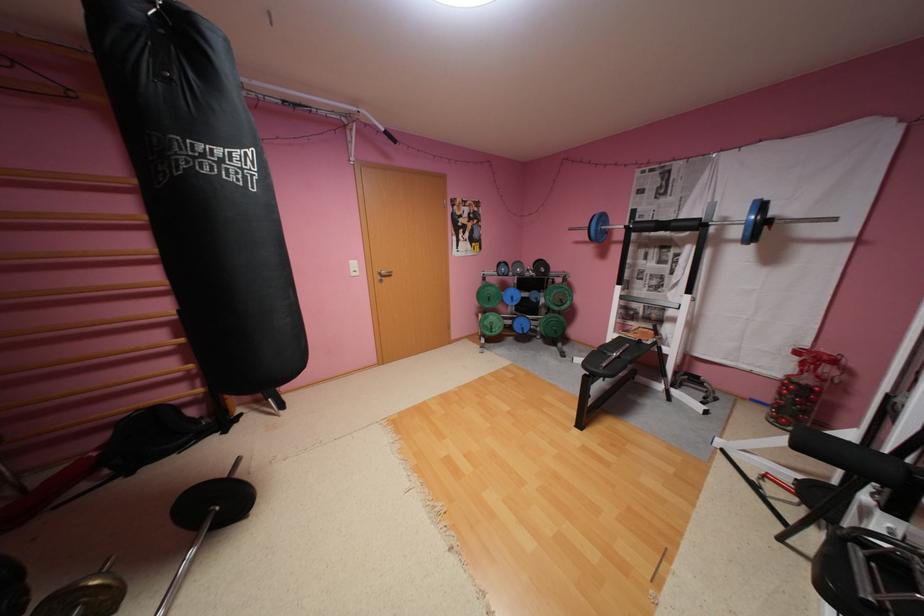
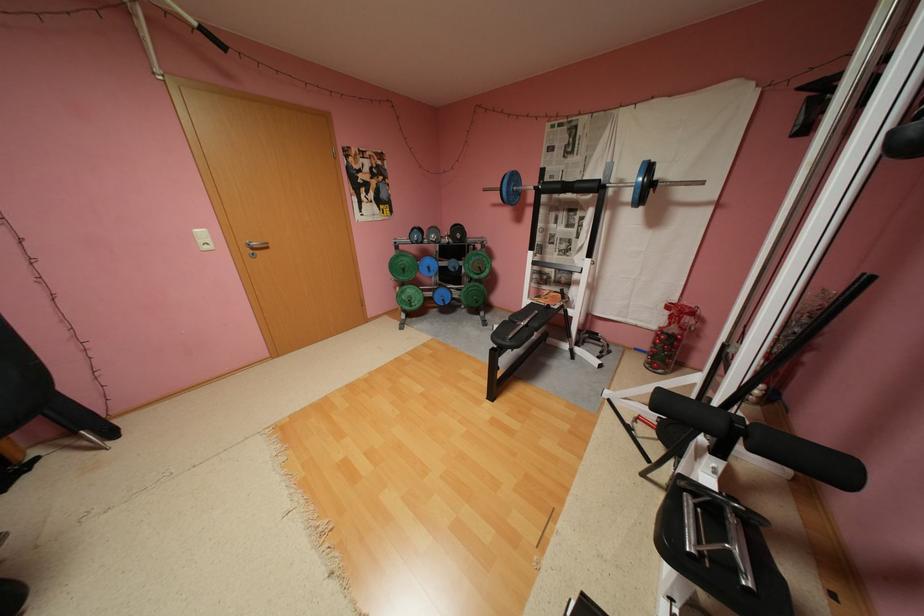
Find the pixel in the second image that matches point (517, 322) in the first image.

(439, 294)